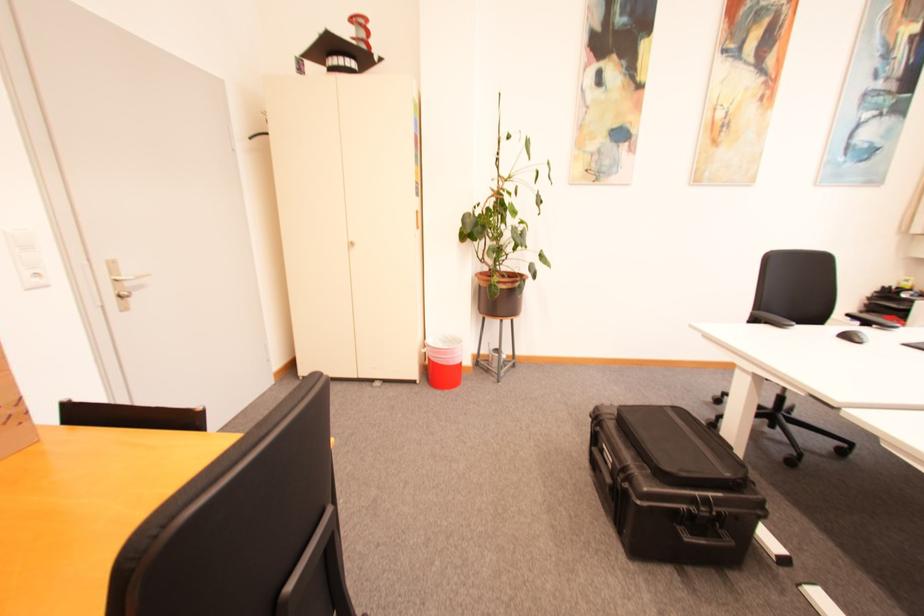
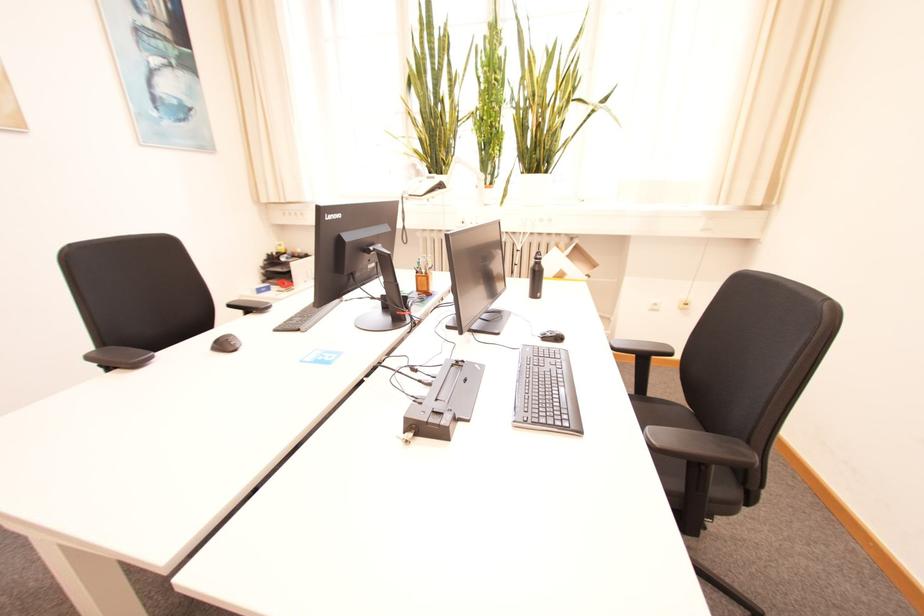
The point at (855, 339) is marked in the first image. Where is the corresponding point in the second image?

(229, 346)